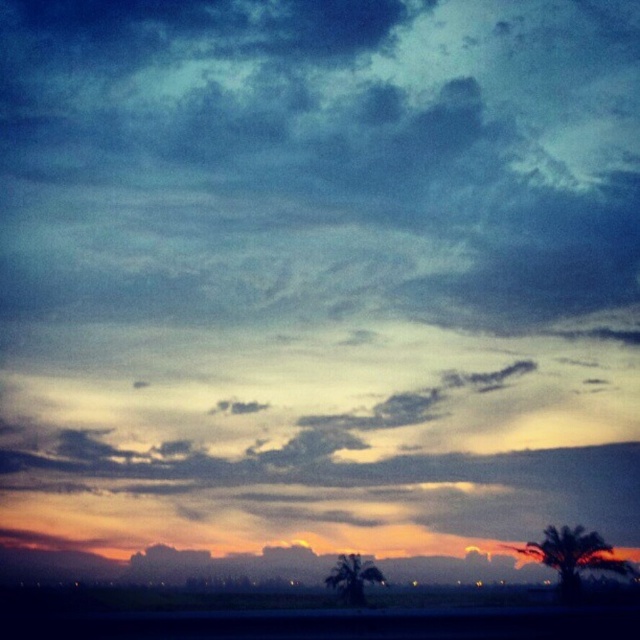
Question: Among these objects, which one is nearest to the camera?

Choices:
 (A) green leafy palm tree at lower right
 (B) green leafy palm tree at lower center

Answer: (B)

Question: Is green leafy palm tree at lower right to the right of green leafy palm tree at lower center from the viewer's perspective?

Choices:
 (A) no
 (B) yes

Answer: (B)

Question: Does green leafy palm tree at lower right appear on the right side of green leafy palm tree at lower center?

Choices:
 (A) yes
 (B) no

Answer: (A)

Question: Which object is farther from the camera taking this photo?

Choices:
 (A) green leafy palm tree at lower center
 (B) green leafy palm tree at lower right

Answer: (B)

Question: Can you confirm if green leafy palm tree at lower right is positioned below green leafy palm tree at lower center?

Choices:
 (A) no
 (B) yes

Answer: (B)

Question: Which object appears closest to the camera in this image?

Choices:
 (A) green leafy palm tree at lower center
 (B) green leafy palm tree at lower right

Answer: (A)